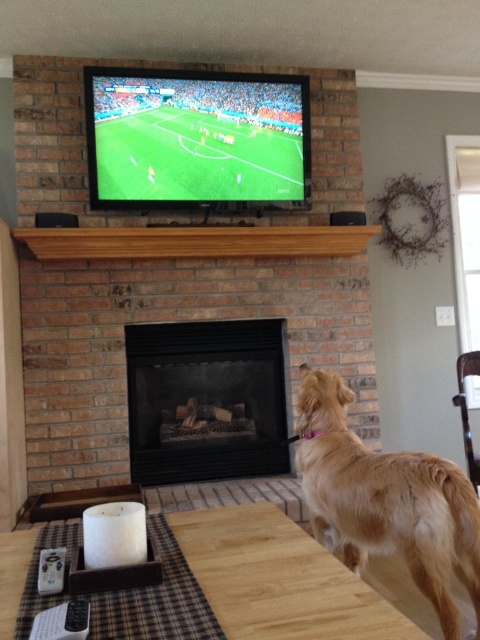
Does point (131, 113) lie behind point (60, 586)?

Yes, point (131, 113) is behind point (60, 586).

Which is in front, point (153, 74) or point (45, 561)?

Point (45, 561)

Image resolution: width=480 pixels, height=640 pixels. What do you see at coordinates (195, 138) in the screenshot?
I see `smooth glossy screen at upper center` at bounding box center [195, 138].

This screenshot has width=480, height=640. Find the location of `smooth glossy screen at upper center`. smooth glossy screen at upper center is located at coordinates (195, 138).

From the picture: Who is more forward, (x=336, y=452) or (x=176, y=340)?

Point (x=336, y=452) is more forward.

Who is taller, golden fur dog at lower right or black glass fireplace at center?

black glass fireplace at center is taller.

The image size is (480, 640). Identify the location of golden fur dog at lower right. (385, 500).

Find the location of a particular element. golden fur dog at lower right is located at coordinates (385, 500).

Which is in front, point (168, 369) or point (59, 637)?

Point (59, 637) is in front.

Between black glass fireplace at center and black plastic remote at lower left, which one is positioned higher?

Positioned higher is black plastic remote at lower left.

This screenshot has width=480, height=640. In order to click on black glass fireplace at center in this screenshot , I will do `click(205, 401)`.